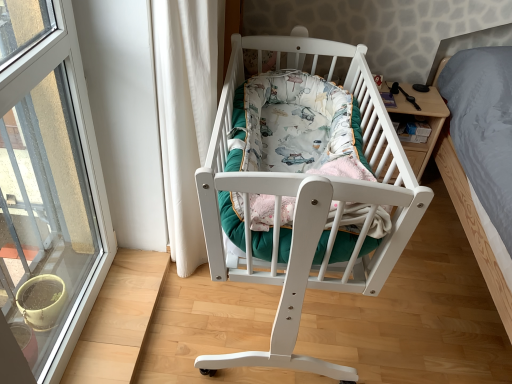
Locate an element on the screen. This screenshot has width=512, height=384. transparent glass window at left is located at coordinates [48, 185].

You are a GUI agent. You are given a task and a screenshot of the screen. Output one action in this format:
    pyautogui.click(x=<x>, y=<y>)
    Task: Click on the printed fabric mattress at center
    This screenshot has width=512, height=384.
    Given the screenshot: What is the action you would take?
    pyautogui.click(x=298, y=127)

At what (x,y) coordinates should I click in order to perform the action: click on transparent glass window at left. Please return your answer as a coordinate pair (x, y). This screenshot has height=384, width=512. Looking at the image, I should click on (48, 185).

Which point is more distant from viewer, (355,80) or (22,214)?

Positioned behind is point (22,214).

Considering the relative positions of white wood crib at center and transparent glass window at left in the image provided, is white wood crib at center to the left of transparent glass window at left from the viewer's perspective?

No, white wood crib at center is not to the left of transparent glass window at left.

Is white wood crib at center surrounding transparent glass window at left?

No, transparent glass window at left is located outside of white wood crib at center.

Which object is further away from the camera, wooden nightstand at right or printed fabric mattress at center?

wooden nightstand at right is further from the camera.

What are the coordinates of `mattress located above the wooden nightstand at right (from a real-world perspective)` in the screenshot? It's located at (298, 127).

Is wooden nightstand at right surrounding printed fabric mattress at center?

Actually, printed fabric mattress at center is outside wooden nightstand at right.

Looking at this image, from their relative heights in the image, would you say wooden nightstand at right is taller or shorter than printed fabric mattress at center?

In the image, wooden nightstand at right appears to be taller than printed fabric mattress at center.

Is point (279, 308) closer to viewer compared to point (446, 113)?

That is True.

In terms of width, does white wood crib at center look wider or thinner when compared to wooden nightstand at right?

Considering their sizes, white wood crib at center looks broader than wooden nightstand at right.

Is white wood crib at center looking in the opposite direction of wooden nightstand at right?

No, white wood crib at center is not facing the opposite direction of wooden nightstand at right.

The width and height of the screenshot is (512, 384). What are the coordinates of `window above the white wood crib at center (from a real-world perspective)` in the screenshot? It's located at (48, 185).

Which object is positioned more to the left, transparent glass window at left or white wood crib at center?

transparent glass window at left is more to the left.

Can you confirm if transparent glass window at left is taller than white wood crib at center?

Correct, transparent glass window at left is much taller as white wood crib at center.

Is printed fabric mattress at center oriented away from wooden nightstand at right?

No, wooden nightstand at right is not at the back of printed fabric mattress at center.

Is printed fabric mattress at center thinner than wooden nightstand at right?

No.

Can you confirm if printed fabric mattress at center is positioned to the right of wooden nightstand at right?

In fact, printed fabric mattress at center is to the left of wooden nightstand at right.

Is transparent glass window at left not close to wooden nightstand at right?

Yes, transparent glass window at left and wooden nightstand at right are located far from each other.

Can you tell me how much transparent glass window at left and wooden nightstand at right differ in facing direction?

90.1 degrees separate the facing orientations of transparent glass window at left and wooden nightstand at right.

In the image, there is a transparent glass window at left. Find the location of `table below it (from a real-world perspective)`. table below it (from a real-world perspective) is located at coordinates (421, 119).

Is transparent glass window at left oriented towards wooden nightstand at right?

No, transparent glass window at left is not turned towards wooden nightstand at right.

Where is `table below the transparent glass window at left (from a real-world perspective)`? The image size is (512, 384). table below the transparent glass window at left (from a real-world perspective) is located at coordinates (421, 119).

Choose the correct answer: Is wooden nightstand at right inside transparent glass window at left or outside it?

wooden nightstand at right is not inside transparent glass window at left, it's outside.

Is wooden nightstand at right oriented away from transparent glass window at left?

No.

The width and height of the screenshot is (512, 384). In order to click on window above the white wood crib at center (from the image's perspective) in this screenshot , I will do `click(48, 185)`.

Where is `table on the right of printed fabric mattress at center`? The image size is (512, 384). table on the right of printed fabric mattress at center is located at coordinates (421, 119).

Estimate the real-world distances between objects in this image. Which object is closer to printed fabric mattress at center, transparent glass window at left or white wood crib at center?

The object closer to printed fabric mattress at center is white wood crib at center.

Which object lies further to the anchor point transparent glass window at left, white wood crib at center or wooden nightstand at right?

wooden nightstand at right.

From the image, which object appears to be nearer to transparent glass window at left, printed fabric mattress at center or white wood crib at center?

Based on the image, white wood crib at center appears to be nearer to transparent glass window at left.

When comparing their distances from white wood crib at center, does wooden nightstand at right or printed fabric mattress at center seem further?

wooden nightstand at right is positioned further to the anchor white wood crib at center.

Which object lies further to the anchor point white wood crib at center, printed fabric mattress at center or wooden nightstand at right?

Among the two, wooden nightstand at right is located further to white wood crib at center.

Which object lies nearer to the anchor point transparent glass window at left, printed fabric mattress at center or wooden nightstand at right?

printed fabric mattress at center is closer to transparent glass window at left.

Looking at the image, which one is located closer to printed fabric mattress at center, wooden nightstand at right or white wood crib at center?

Based on the image, white wood crib at center appears to be nearer to printed fabric mattress at center.

When comparing their distances from printed fabric mattress at center, does white wood crib at center or wooden nightstand at right seem closer?

white wood crib at center is positioned closer to the anchor printed fabric mattress at center.

In order to click on mattress between transparent glass window at left and white wood crib at center in this screenshot , I will do `click(298, 127)`.

Locate an element on the screen. Image resolution: width=512 pixels, height=384 pixels. mattress located between transparent glass window at left and wooden nightstand at right in the depth direction is located at coordinates (298, 127).

The width and height of the screenshot is (512, 384). In order to click on infant bed between transparent glass window at left and wooden nightstand at right from front to back in this screenshot , I will do `click(309, 206)`.

Find the location of a particular element. infant bed between printed fabric mattress at center and wooden nightstand at right from front to back is located at coordinates (309, 206).